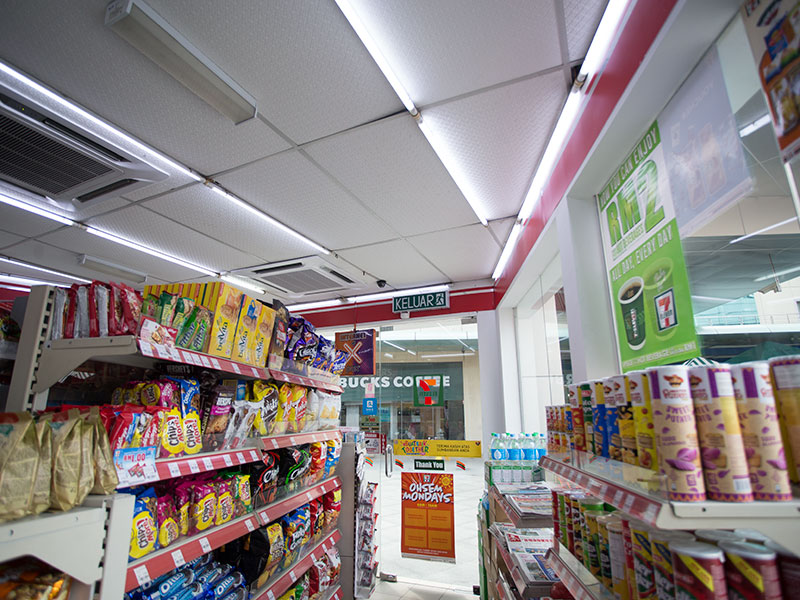
You are a GUI agent. You are given a task and a screenshot of the screen. Output one action in this format:
    pyautogui.click(x=<x>, y=<y>)
    Task: Click on the exit sign
    This screenshot has width=800, height=600.
    Given the screenshot: What is the action you would take?
    pyautogui.click(x=422, y=297)